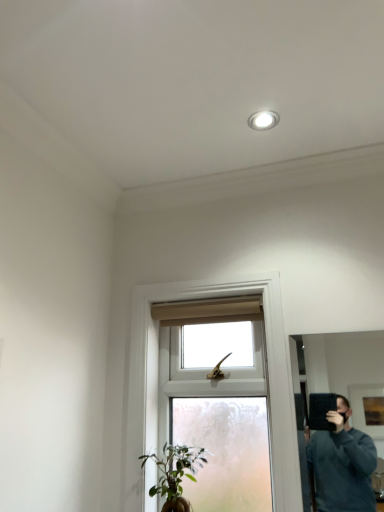
Question: From a real-world perspective, relative to white glossy recessed light at upper center, is green matte plant at lower center vertically above or below?

Choices:
 (A) below
 (B) above

Answer: (A)

Question: Relative to white glossy recessed light at upper center, is green matte plant at lower center in front or behind?

Choices:
 (A) behind
 (B) front

Answer: (B)

Question: Which object is positioned closest to the white glossy recessed light at upper center?

Choices:
 (A) clear glass window at center
 (B) green matte plant at lower center
 (C) black matte mirror at right

Answer: (A)

Question: Estimate the real-world distances between objects in this image. Which object is farther from the clear glass window at center?

Choices:
 (A) green matte plant at lower center
 (B) white glossy recessed light at upper center
 (C) black matte mirror at right

Answer: (C)